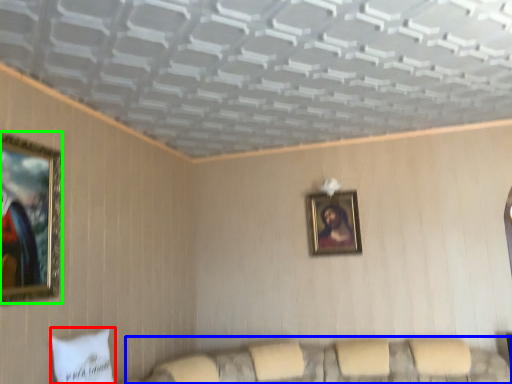
Question: Estimate the real-world distances between objects in this image. Which object is farther from pillow (highlighted by a red box), couch (highlighted by a blue box) or picture frame (highlighted by a green box)?

Choices:
 (A) couch
 (B) picture frame

Answer: (A)